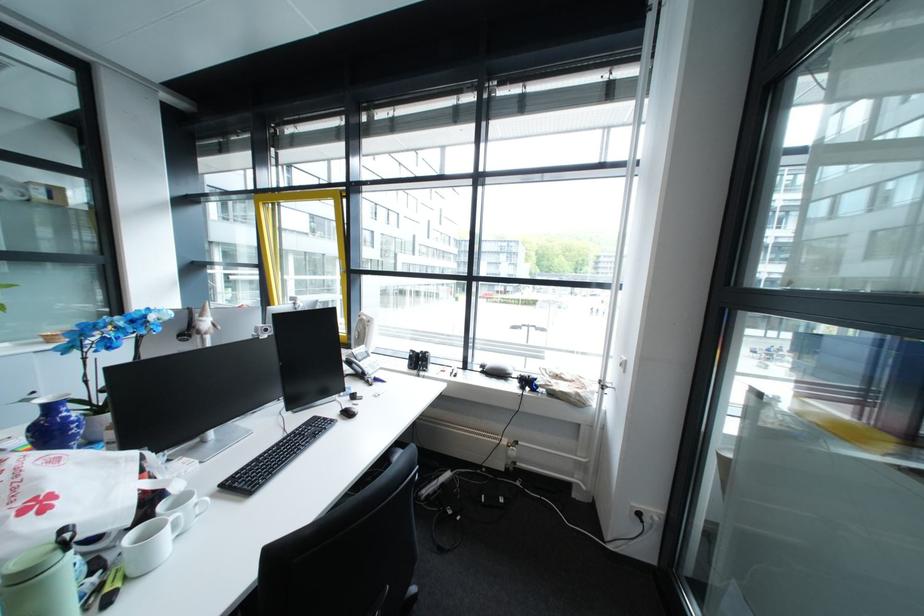
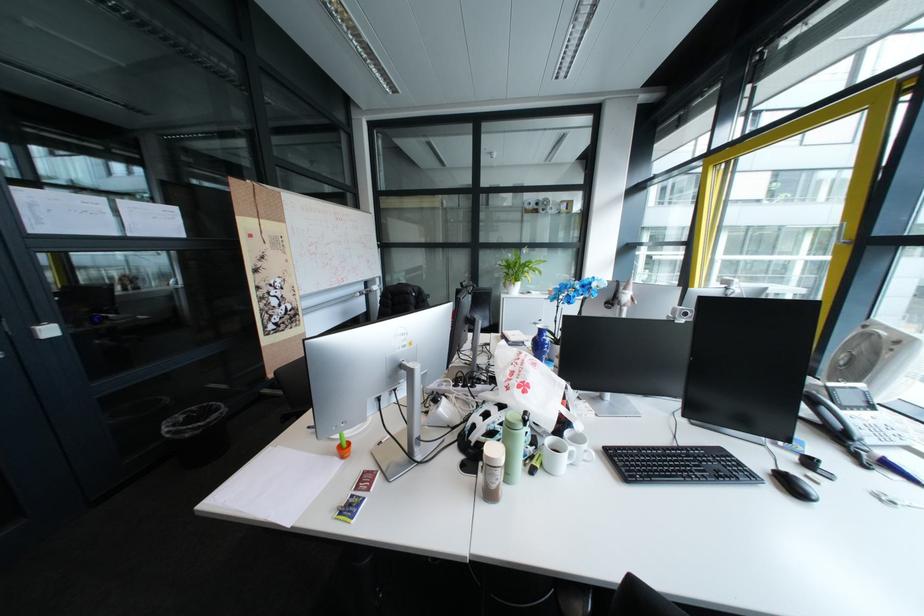
Find the pixel in the second image that matches (361,415) in the first image.

(805, 487)